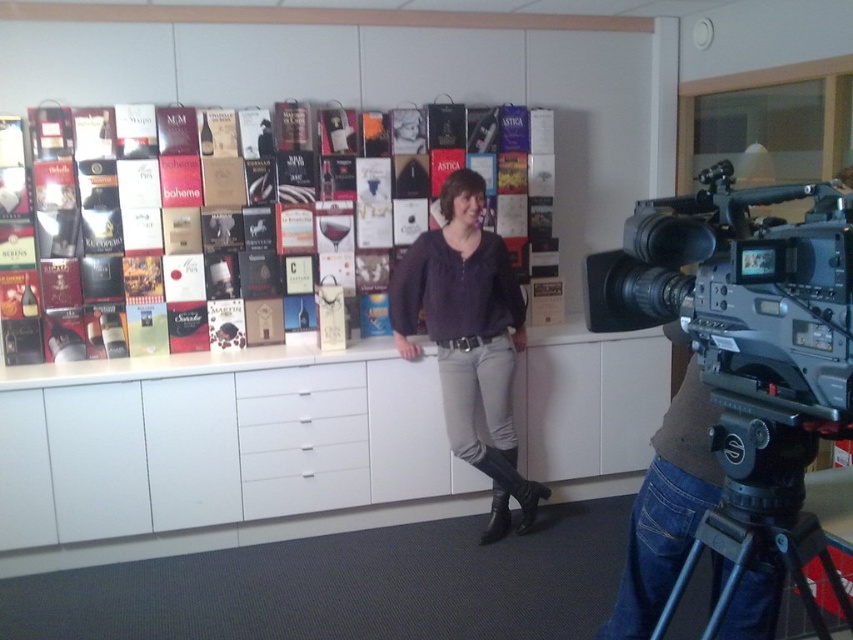
Question: Which of these objects is positioned farthest from the silver metallic video camera at right?

Choices:
 (A) black plastic tripod at lower right
 (B) matte purple sweater at center
 (C) matte cardboard wine box at center
 (D) white glossy drawer at center

Answer: (C)

Question: Which of the following is the closest to the observer?

Choices:
 (A) white glossy drawer at center
 (B) black plastic tripod at lower right
 (C) matte purple sweater at center
 (D) matte cardboard wine box at center

Answer: (B)

Question: Does matte cardboard wine box at center appear over black plastic tripod at lower right?

Choices:
 (A) no
 (B) yes

Answer: (B)

Question: Is matte purple sweater at center below black plastic tripod at lower right?

Choices:
 (A) yes
 (B) no

Answer: (B)

Question: Does silver metallic video camera at right appear over matte purple sweater at center?

Choices:
 (A) yes
 (B) no

Answer: (A)

Question: Which object is positioned farthest from the white glossy drawer at center?

Choices:
 (A) silver metallic video camera at right
 (B) matte cardboard wine box at center
 (C) matte purple sweater at center
 (D) black plastic tripod at lower right

Answer: (D)